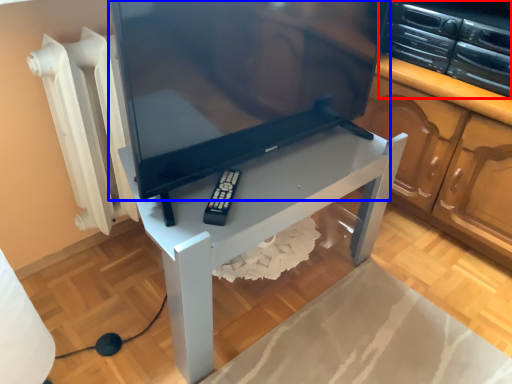
Question: Which object appears closest to the camera in this image, appliance (highlighted by a red box) or television (highlighted by a blue box)?

Choices:
 (A) appliance
 (B) television

Answer: (B)